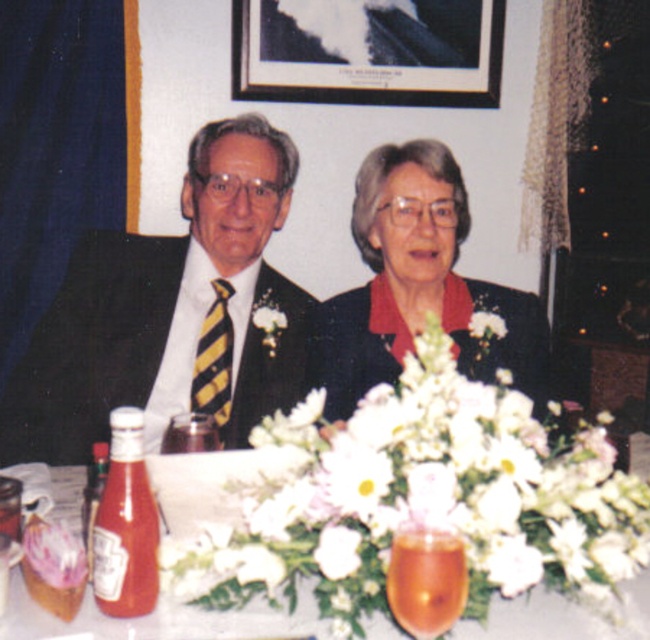
Question: Which point is farther from the camera taking this photo?

Choices:
 (A) (484, 314)
 (B) (604, 625)

Answer: (A)

Question: Does matte black jacket at center come behind black matte picture frame at upper center?

Choices:
 (A) no
 (B) yes

Answer: (A)

Question: Which object appears closest to the camera in this image?

Choices:
 (A) matte glass bottle of ketchup at lower left
 (B) matte black suit at left
 (C) white matte flower at center

Answer: (C)

Question: Considering the relative positions of white matte flower at center and matte glass bottle of ketchup at lower left in the image provided, where is white matte flower at center located with respect to matte glass bottle of ketchup at lower left?

Choices:
 (A) below
 (B) above

Answer: (B)

Question: Is white matte flower at center smaller than matte black suit at left?

Choices:
 (A) no
 (B) yes

Answer: (A)

Question: Which object is closer to the camera taking this photo?

Choices:
 (A) translucent glass vase at center
 (B) matte black suit at left
 (C) matte black jacket at center
 (D) black matte picture frame at upper center

Answer: (A)